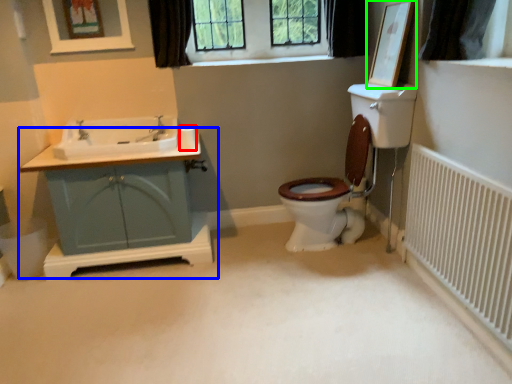
Question: Estimate the real-world distances between objects in this image. Which object is farther from toilet paper (highlighted by a red box), bathroom cabinet (highlighted by a blue box) or picture frame (highlighted by a green box)?

Choices:
 (A) bathroom cabinet
 (B) picture frame

Answer: (B)